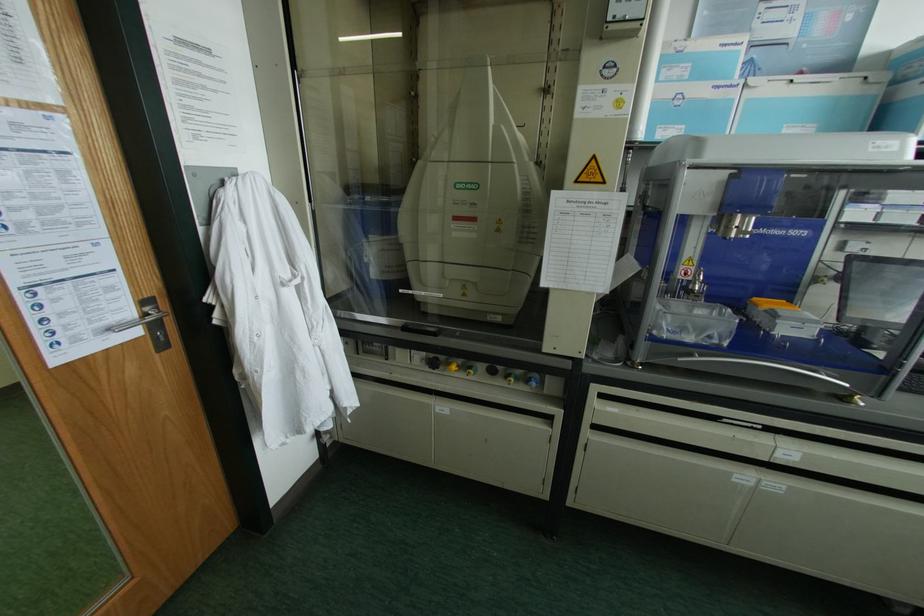
The image size is (924, 616). Describe the element at coordinates (531, 379) in the screenshot. I see `the blue control knob` at that location.